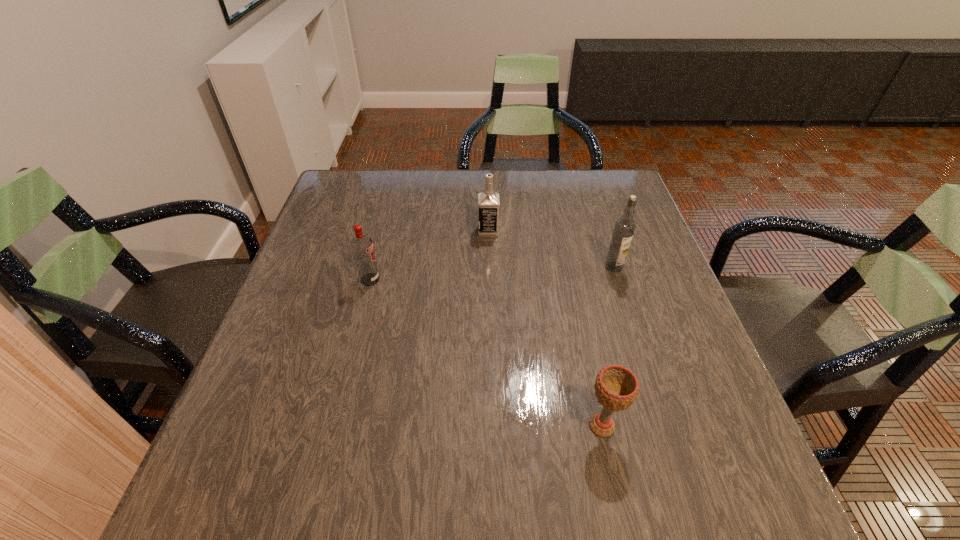
Where is `vacant area at the far right corner`? vacant area at the far right corner is located at coordinates (600, 184).

Image resolution: width=960 pixels, height=540 pixels. What are the coordinates of `vacant area that lies between the tallest vodka and the leftmost object` in the screenshot? It's located at (492, 273).

Locate an element on the screen. Image resolution: width=960 pixels, height=540 pixels. vacant area that lies between the nearest object and the second object from left to right is located at coordinates (545, 328).

I want to click on empty space that is in between the leftmost vodka and the rightmost object, so click(x=492, y=273).

Where is `free spot between the third object from right to left and the leftmost vodka`? This screenshot has width=960, height=540. free spot between the third object from right to left and the leftmost vodka is located at coordinates click(429, 255).

The height and width of the screenshot is (540, 960). I want to click on vacant area between the chalice and the leftmost object, so pyautogui.click(x=486, y=353).

The height and width of the screenshot is (540, 960). What are the coordinates of `empty space that is in between the third object from left to right and the leftmost vodka` in the screenshot? It's located at (486, 353).

This screenshot has width=960, height=540. Identify the location of free space between the second vodka from right to left and the leftmost object. (429, 255).

Find the location of a particular element. Image resolution: width=960 pixels, height=540 pixels. vacant space that is in between the farthest vodka and the third object from left to right is located at coordinates (545, 328).

At what (x,y) coordinates should I click in order to perform the action: click on blank region between the third object from right to left and the leftmost object. Please return your answer as a coordinate pair (x, y). Looking at the image, I should click on (429, 255).